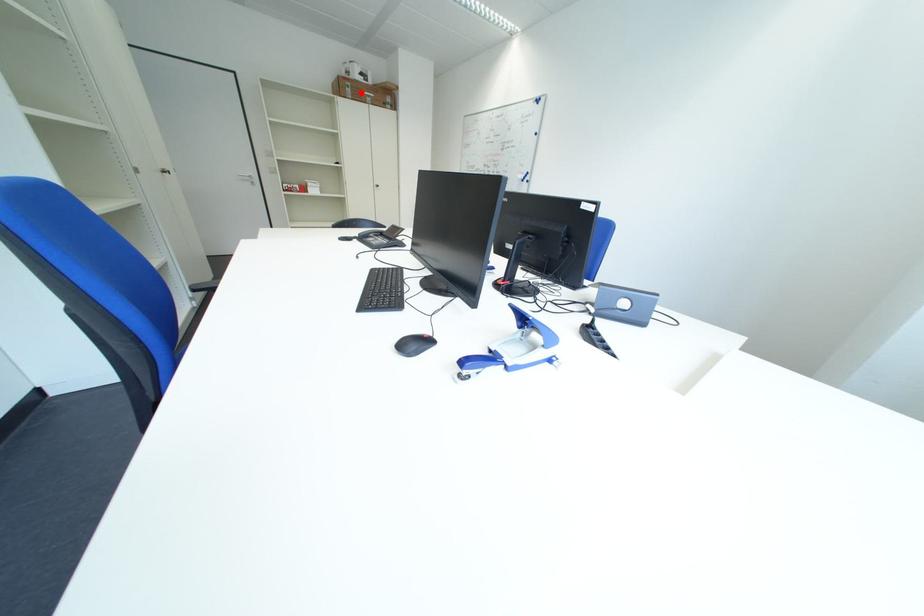
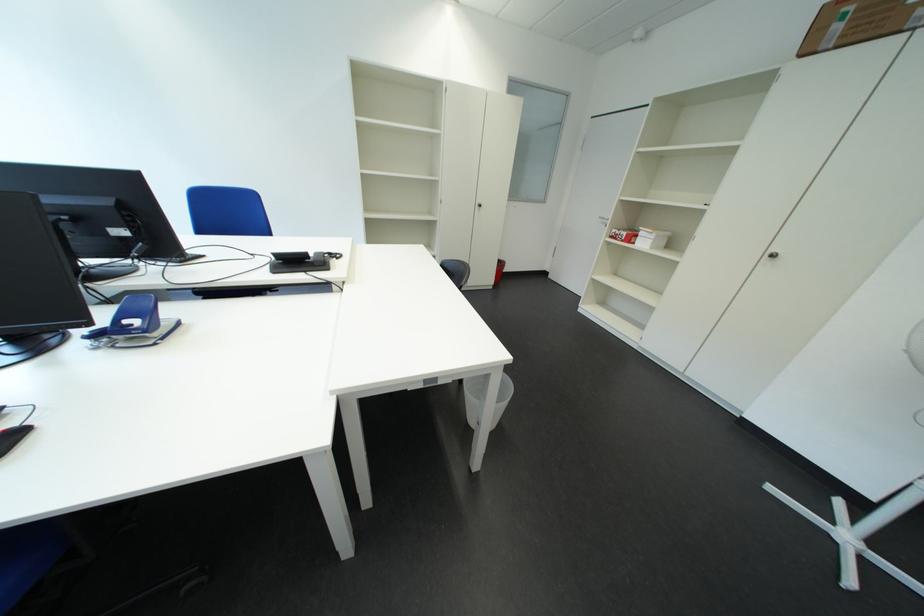
Find the pixel in the second image that matches the highlighted location in the first image.

(849, 30)